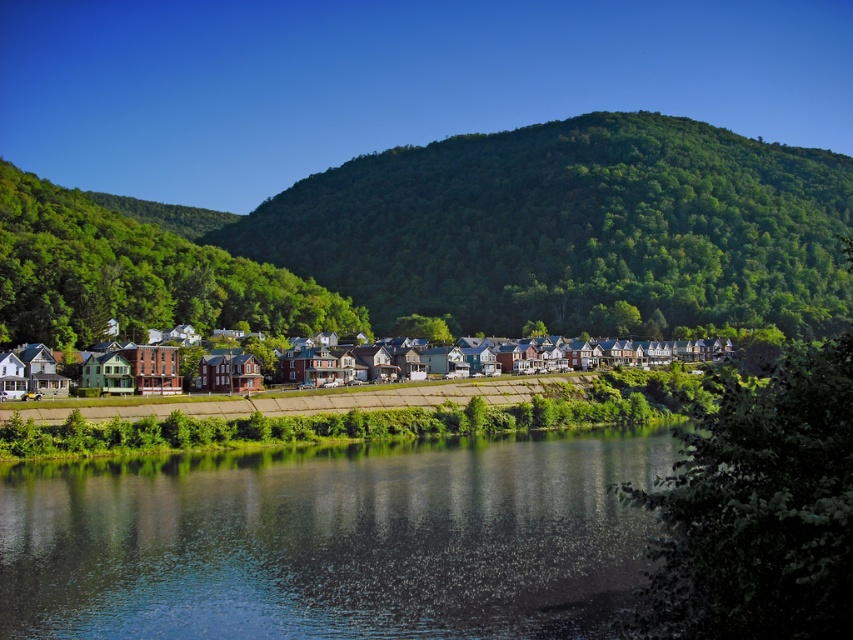
Question: Which object appears farthest from the camera in this image?

Choices:
 (A) smooth reflective water at center
 (B) multicolored brick houses at center

Answer: (B)

Question: Among these points, which one is farthest from the camera?

Choices:
 (A) (599, 356)
 (B) (491, 490)

Answer: (A)

Question: Does smooth reflective water at center appear on the right side of multicolored brick houses at center?

Choices:
 (A) yes
 (B) no

Answer: (B)

Question: Where is smooth reflective water at center located in relation to multicolored brick houses at center in the image?

Choices:
 (A) above
 (B) below

Answer: (B)

Question: Is smooth reflective water at center closer to the viewer compared to multicolored brick houses at center?

Choices:
 (A) no
 (B) yes

Answer: (B)

Question: Which of the following is the farthest from the observer?

Choices:
 (A) multicolored brick houses at center
 (B) smooth reflective water at center

Answer: (A)